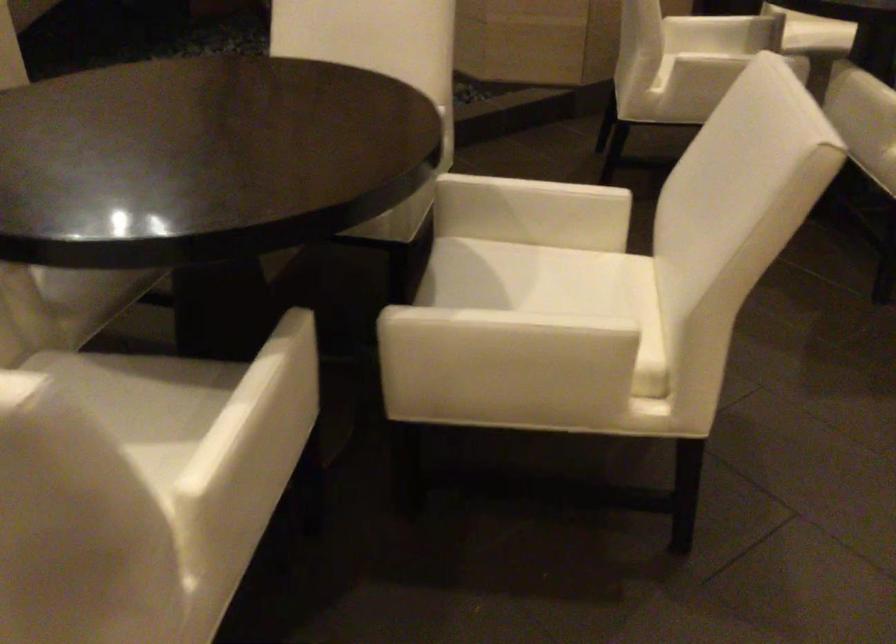
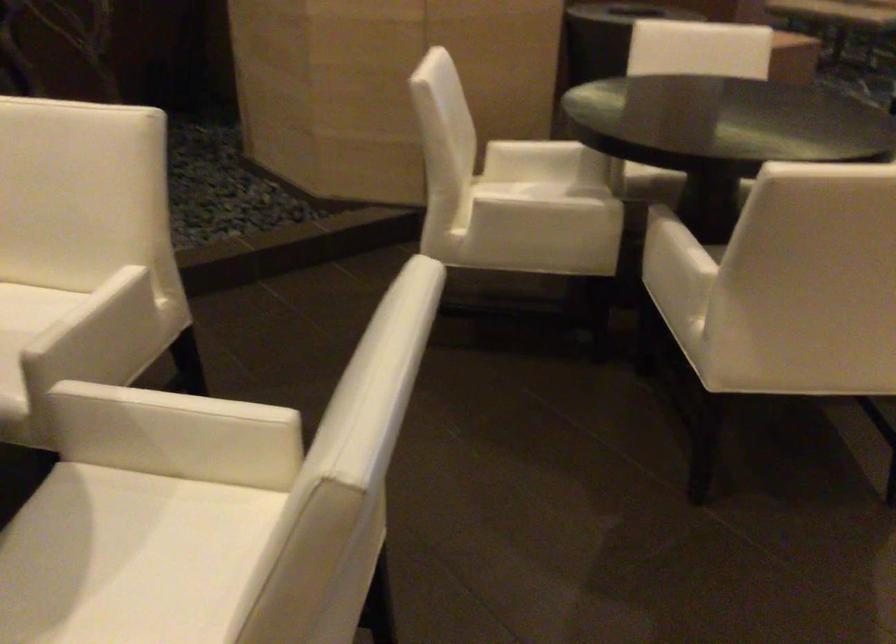
Locate, in the second image, the point that corresponds to (x=538, y=181) in the first image.

(179, 402)